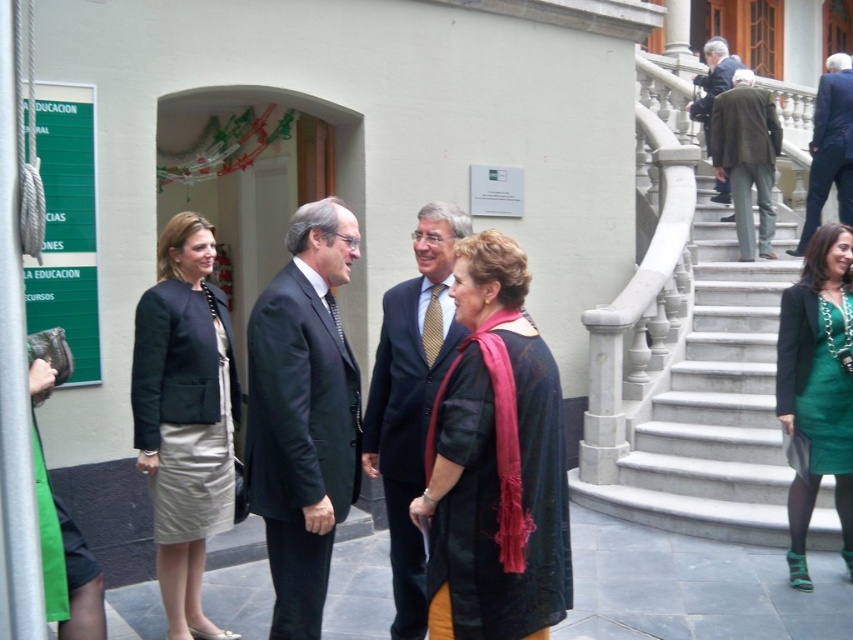
You are a photographer at this event and want to ensure all subjects are in focus. The silk beige skirt at center and the blue suit at upper right are two key elements. Considering their heights, which one might require you to adjust your camera focus to capture details more clearly?

The silk beige skirt at center has a lesser height compared to blue suit at upper right, so you might need to adjust the focus for the silk beige skirt at center to ensure its details are captured clearly since it is shorter and possibly closer to the camera.

You are organizing a photo shoot and need to arrange the silk beige skirt at center and the green satin dress at lower right in a way that highlights both. Considering their sizes, which one should be placed in a more prominent position to ensure visibility?

The green satin dress at lower right should be placed in a more prominent position because it occupies more space than the silk beige skirt at center, making it easier to highlight its details.